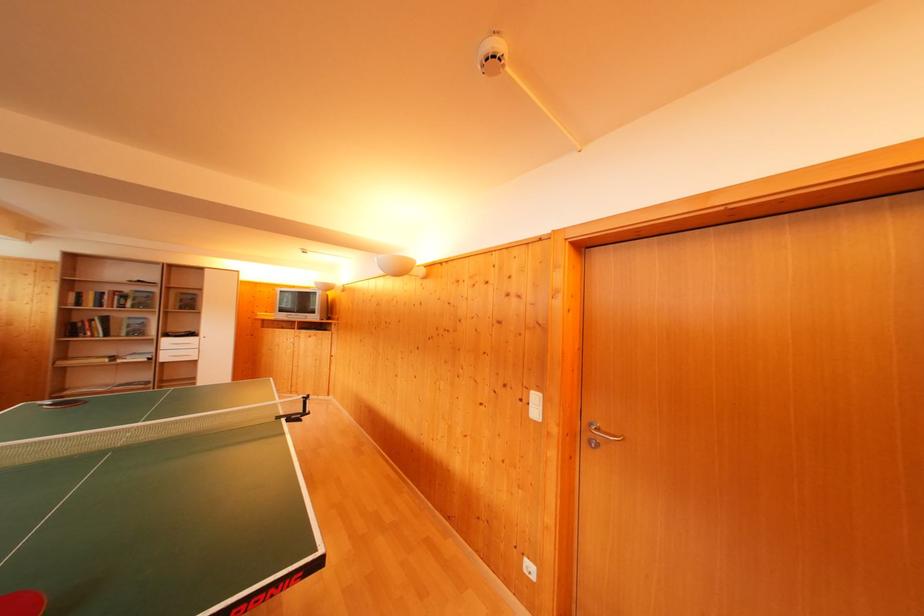
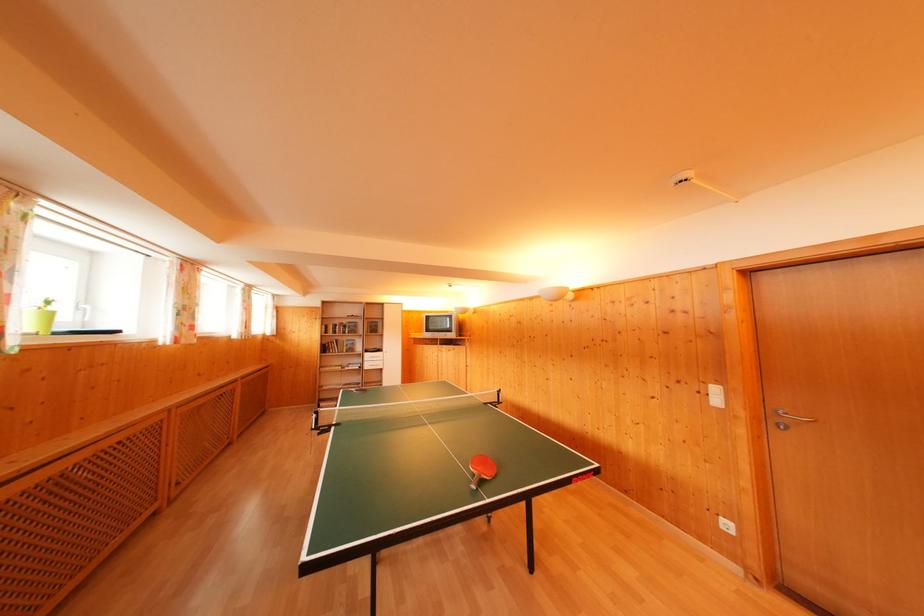
The images are taken continuously from a first-person perspective. In which direction are you moving?

The cameraman moved toward left, backward.